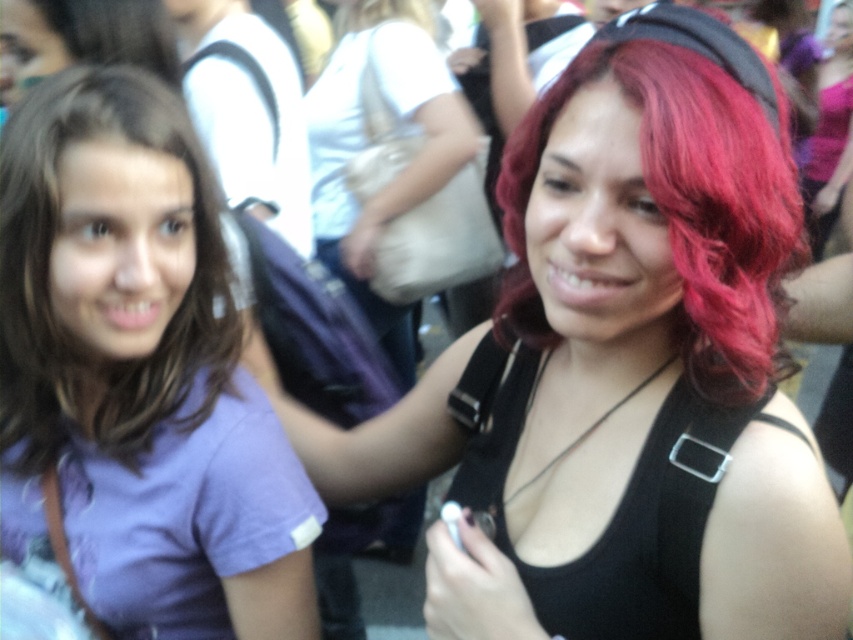
Looking at this image, you are organizing a photo shoot and need to ensure that the purple cotton shirt at left and the vivid red hair at center are clearly visible in the frame. Based on their sizes, which object should you focus on first to ensure proper framing?

The purple cotton shirt at left is bigger than the vivid red hair at center, so you should focus on the purple cotton shirt at left first to ensure proper framing.

You are holding a camera and want to take a photo of the scene. The camera has a focus range of 90 cm to infinity. Is the point at coordinates point (97,292) within the focus range of the camera?

The distance of point (97,292) from camera is 89.35 centimeters, which is just below the camera focus range of 90 cm. Therefore, the point is slightly out of focus.